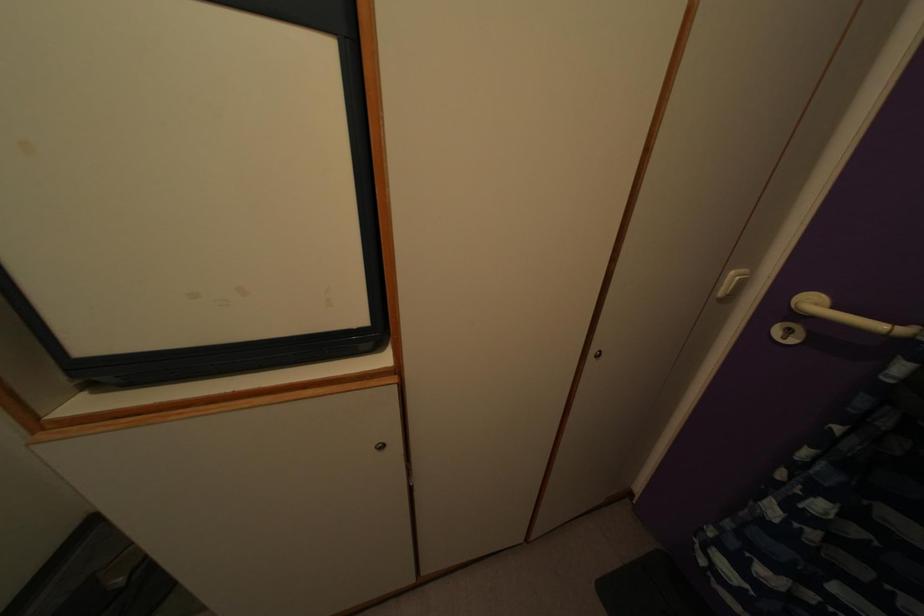
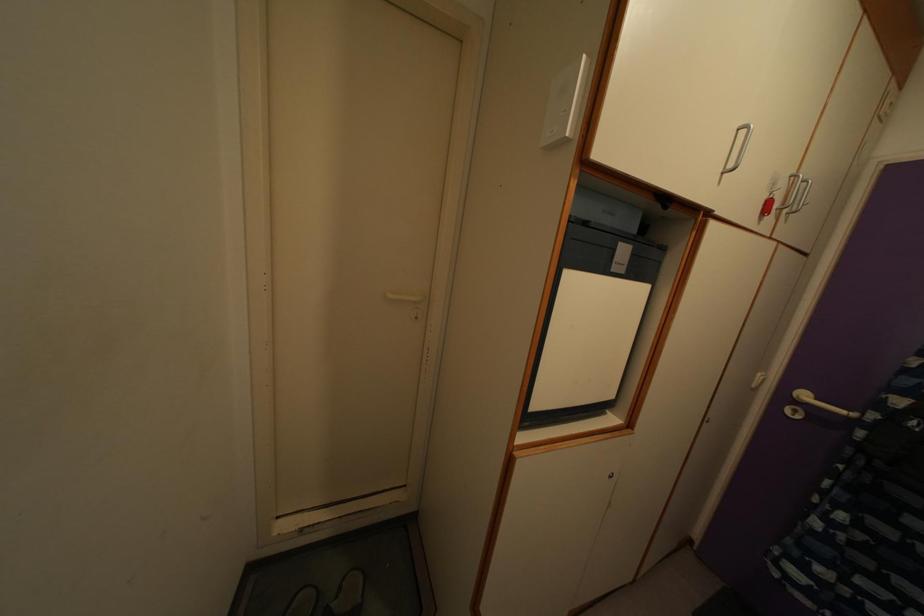
The images are taken continuously from a first-person perspective. In which direction are you moving?

The cameraman walked toward left, backward.